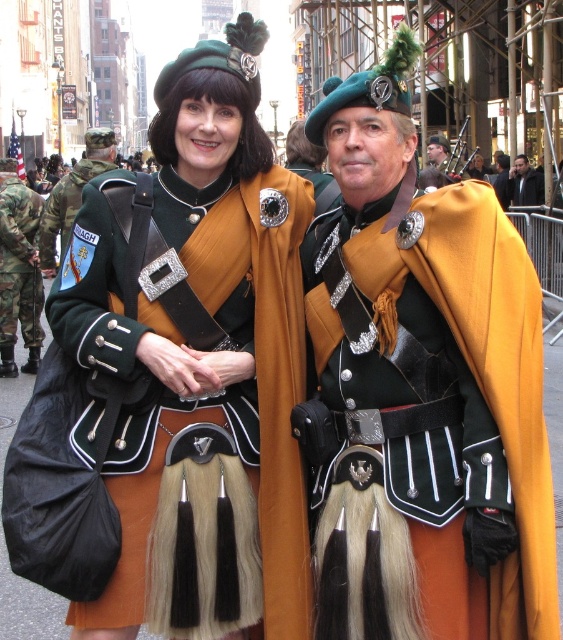
You are a photographer trying to capture a photo of the gold matte cape at center and the camouflage fabric pants at left. Based on their positions, which object should you focus on first to ensure both are in frame?

The gold matte cape at center is positioned on the right side of camouflage fabric pants at left, so you should focus on the camouflage fabric pants at left first to ensure both are in frame.

You are a costume designer preparing for a play. You need to decide which costume to use based on the image. Which object is bigger in size between the gold matte cape at center and the dark brown fur coat at center?

The gold matte cape at center has a larger size compared to the dark brown fur coat at center, so the gold matte cape at center is bigger in size.